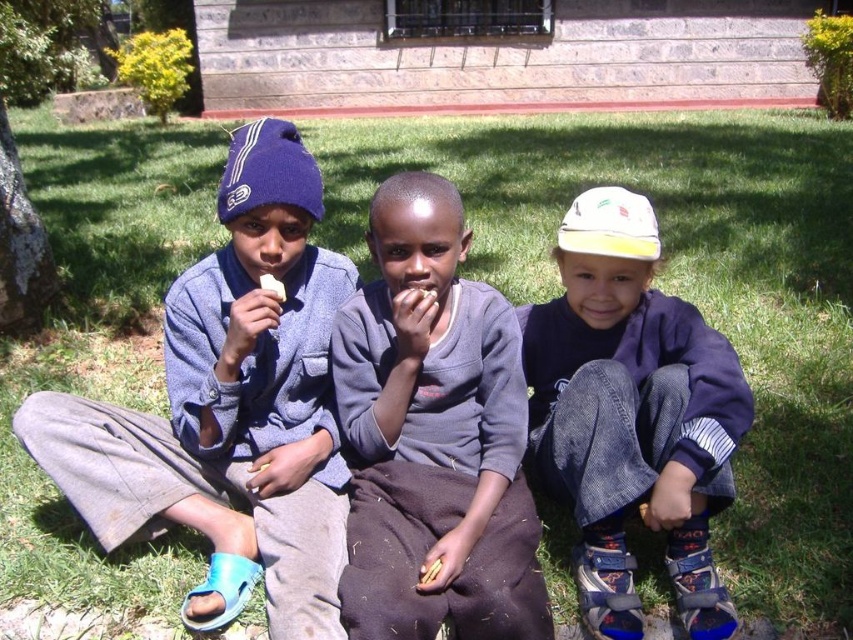
Based on the coordinates provided, which object corresponds to the point at (x=230, y=408)?

The point at (x=230, y=408) corresponds to the blue knit beanie at left.

You are standing 5 feet away from the blue knit beanie at left. Can you reach it without moving your feet?

The blue knit beanie at left is 6.29 feet away from the viewer. Since you are standing 5 feet away, you can reach it without moving your feet because it is within arm reach.